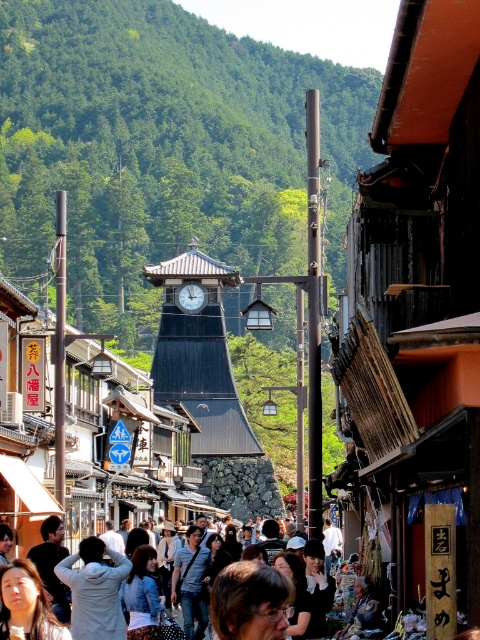
Who is positioned more to the right, dark wood clock tower at center or light brown hair at center?

light brown hair at center is more to the right.

Does point (184, 358) come closer to viewer compared to point (84, 540)?

That is False.

You are a GUI agent. You are given a task and a screenshot of the screen. Output one action in this format:
    pyautogui.click(x=<x>, y=<y>)
    Task: Click on the dark wood clock tower at center
    
    Given the screenshot: What is the action you would take?
    pyautogui.click(x=200, y=355)

Can you confirm if light brown hair at center is wider than matte black clock tower at center?

Indeed, light brown hair at center has a greater width compared to matte black clock tower at center.

Describe the element at coordinates (92, 548) in the screenshot. This screenshot has height=640, width=480. I see `light brown hair at center` at that location.

The height and width of the screenshot is (640, 480). What are the coordinates of `light brown hair at center` in the screenshot? It's located at (92, 548).

Looking at this image, does dark wood clock tower at center have a larger size compared to matte black clock tower at center?

Indeed, dark wood clock tower at center has a larger size compared to matte black clock tower at center.

Does dark wood clock tower at center have a lesser height compared to matte black clock tower at center?

No.

Image resolution: width=480 pixels, height=640 pixels. What are the coordinates of `dark wood clock tower at center` in the screenshot? It's located at point(200,355).

I want to click on dark wood clock tower at center, so click(200, 355).